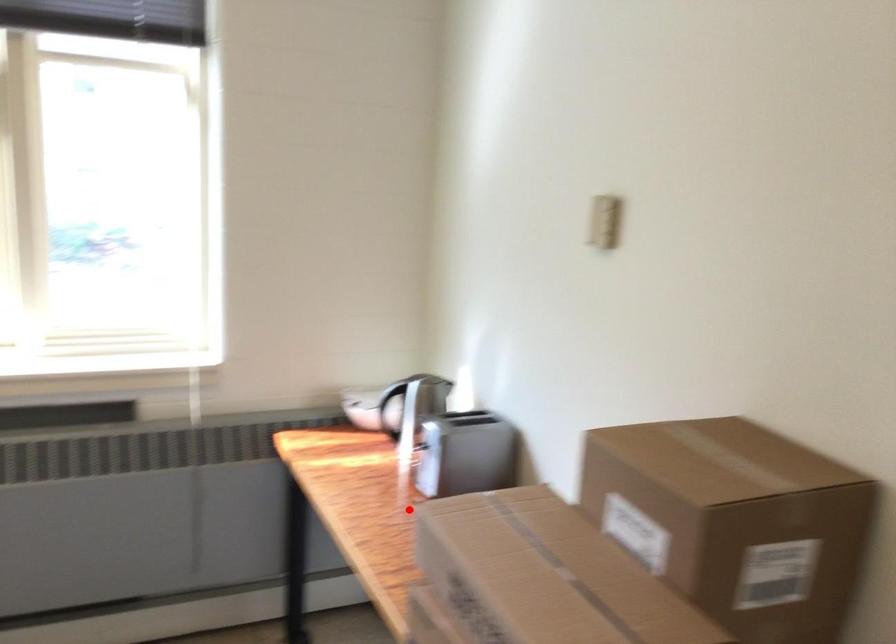
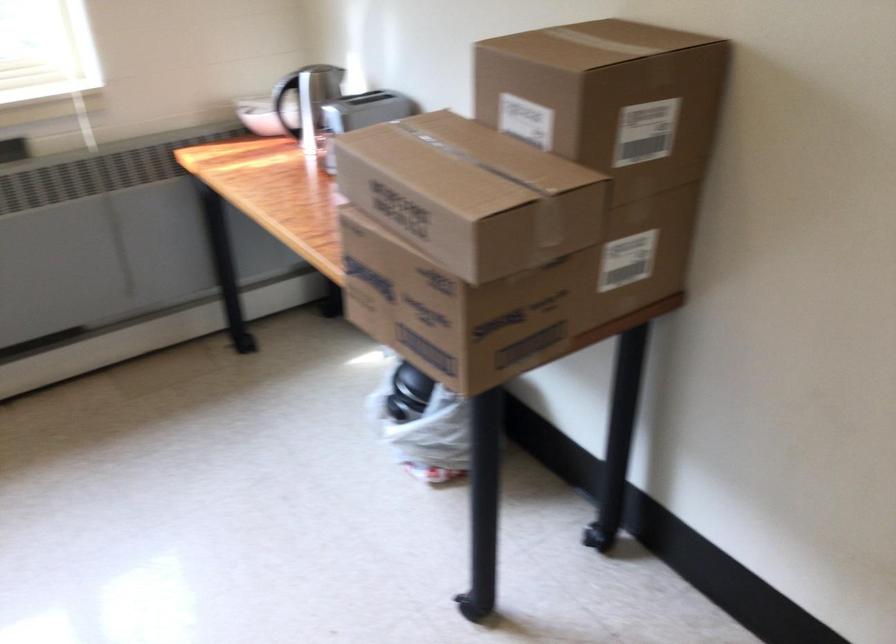
Find the pixel in the second image that matches the highlighted location in the first image.

(323, 138)